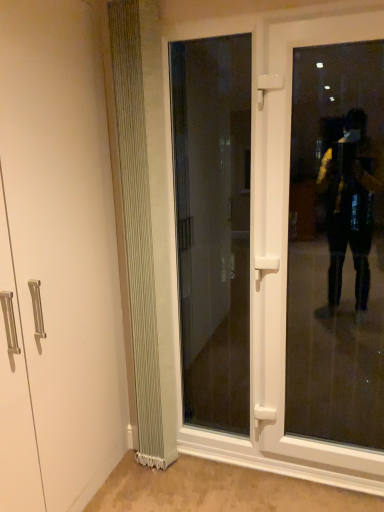
Image resolution: width=384 pixels, height=512 pixels. What are the coordinates of `white plastic door at center, placed as the second door when sorted from left to right` in the screenshot? It's located at (267, 243).

This screenshot has height=512, width=384. What do you see at coordinates (267, 243) in the screenshot?
I see `white plastic door at center, placed as the second door when sorted from left to right` at bounding box center [267, 243].

In order to face transparent glass door at right, should I rotate leftwards or rightwards?

You should rotate right by 17.114 degrees.

This screenshot has width=384, height=512. Describe the element at coordinates (145, 220) in the screenshot. I see `white ribbed radiator at left` at that location.

The height and width of the screenshot is (512, 384). Identify the location of transparent glass door at center, the 2th door positioned from the right. (213, 225).

Is white plastic door at center, positioned as the 1th door in right-to-left order, placed right next to transparent glass door at right?

white plastic door at center, positioned as the 1th door in right-to-left order, and transparent glass door at right are clearly separated.

Considering the sizes of objects white plastic door at center, placed as the second door when sorted from left to right, and transparent glass door at right in the image provided, who is bigger, white plastic door at center, placed as the second door when sorted from left to right, or transparent glass door at right?

Bigger between the two is transparent glass door at right.

Which object is closer to the camera taking this photo, white plastic door at center, placed as the second door when sorted from left to right, or transparent glass door at right?

transparent glass door at right is closer to the camera.

How much distance is there between transparent glass door at center, which appears as the 1th door when viewed from the left, and transparent glass door at right?

transparent glass door at center, which appears as the 1th door when viewed from the left, and transparent glass door at right are 29.16 inches apart from each other.

Looking at their sizes, would you say transparent glass door at center, the 2th door positioned from the right, is wider or thinner than transparent glass door at right?

Clearly, transparent glass door at center, the 2th door positioned from the right, has less width compared to transparent glass door at right.

Considering the relative positions of transparent glass door at center, the 2th door positioned from the right, and transparent glass door at right in the image provided, is transparent glass door at center, the 2th door positioned from the right, in front of transparent glass door at right?

No, it is behind transparent glass door at right.

Which of these two, transparent glass door at center, which appears as the 1th door when viewed from the left, or transparent glass door at right, stands shorter?

transparent glass door at center, which appears as the 1th door when viewed from the left, is shorter.

You are a GUI agent. You are given a task and a screenshot of the screen. Output one action in this format:
    pyautogui.click(x=<x>, y=<y>)
    Task: Click on the radiator above the transparent glass door at right (from the image's perspective)
    The width and height of the screenshot is (384, 512).
    Given the screenshot: What is the action you would take?
    pyautogui.click(x=145, y=220)

Is point (314, 409) in front of point (160, 109)?

No, it is not.

Is transparent glass door at right further to camera compared to white ribbed radiator at left?

No, transparent glass door at right is closer to the camera.

Is transparent glass door at right not close to white ribbed radiator at left?

Absolutely, transparent glass door at right is distant from white ribbed radiator at left.

Is transparent glass door at center, which appears as the 1th door when viewed from the left, facing towards white plastic door at center, placed as the second door when sorted from left to right?

Yes, transparent glass door at center, which appears as the 1th door when viewed from the left, is turned towards white plastic door at center, placed as the second door when sorted from left to right.

Looking at this image, from a real-world perspective, is transparent glass door at center, which appears as the 1th door when viewed from the left, positioned under white plastic door at center, placed as the second door when sorted from left to right, based on gravity?

No, from a real-world perspective, transparent glass door at center, which appears as the 1th door when viewed from the left, is not under white plastic door at center, placed as the second door when sorted from left to right.

Considering the sizes of transparent glass door at center, the 2th door positioned from the right, and white plastic door at center, positioned as the 1th door in right-to-left order, in the image, is transparent glass door at center, the 2th door positioned from the right, taller or shorter than white plastic door at center, positioned as the 1th door in right-to-left order,?

transparent glass door at center, the 2th door positioned from the right, is taller than white plastic door at center, positioned as the 1th door in right-to-left order.

Which is more to the left, transparent glass door at center, which appears as the 1th door when viewed from the left, or white plastic door at center, positioned as the 1th door in right-to-left order?

Positioned to the left is transparent glass door at center, which appears as the 1th door when viewed from the left.

Which is in front, point (340, 123) or point (350, 476)?

The point (340, 123) is in front.

Is transparent glass door at right at the left side of white plastic door at center, placed as the second door when sorted from left to right?

Incorrect, transparent glass door at right is not on the left side of white plastic door at center, placed as the second door when sorted from left to right.

From the image's perspective, is transparent glass door at right located beneath white plastic door at center, placed as the second door when sorted from left to right?

No, from the image's perspective, transparent glass door at right is not below white plastic door at center, placed as the second door when sorted from left to right.

Looking at this image, which point is more distant from viewer, (132,73) or (197,239)?

The point (197,239) is farther from the camera.

Would you say white ribbed radiator at left is a long distance from transparent glass door at center, which appears as the 1th door when viewed from the left?

Yes, white ribbed radiator at left and transparent glass door at center, which appears as the 1th door when viewed from the left, are located far from each other.

Would you say white ribbed radiator at left is outside transparent glass door at center, the 2th door positioned from the right?

Yes, white ribbed radiator at left is not within transparent glass door at center, the 2th door positioned from the right.

Is white ribbed radiator at left bigger than transparent glass door at center, the 2th door positioned from the right?

Indeed, white ribbed radiator at left has a larger size compared to transparent glass door at center, the 2th door positioned from the right.

Which is behind, point (334, 54) or point (237, 89)?

The point (334, 54) is farther.

Where is `door above the transparent glass door at right (from a real-world perspective)`? The height and width of the screenshot is (512, 384). door above the transparent glass door at right (from a real-world perspective) is located at coordinates [213, 225].

Does transparent glass door at right appear on the left side of transparent glass door at center, which appears as the 1th door when viewed from the left?

No, transparent glass door at right is not to the left of transparent glass door at center, which appears as the 1th door when viewed from the left.

Which door is the 1st one when counting from the left side of the transparent glass door at right? Please provide its 2D coordinates.

[(267, 243)]

In order to click on door above the transparent glass door at right (from the image's perspective) in this screenshot , I will do `click(213, 225)`.

Which object lies nearer to the anchor point transparent glass door at right, transparent glass door at center, the 2th door positioned from the right, or white ribbed radiator at left?

transparent glass door at center, the 2th door positioned from the right, lies closer to transparent glass door at right than the other object.

Estimate the real-world distances between objects in this image. Which object is further from white plastic door at center, positioned as the 1th door in right-to-left order, transparent glass door at center, which appears as the 1th door when viewed from the left, or transparent glass door at right?

transparent glass door at right.

From the image, which object appears to be nearer to white plastic door at center, positioned as the 1th door in right-to-left order, transparent glass door at right or transparent glass door at center, which appears as the 1th door when viewed from the left?

transparent glass door at center, which appears as the 1th door when viewed from the left, is closer to white plastic door at center, positioned as the 1th door in right-to-left order.

Estimate the real-world distances between objects in this image. Which object is closer to white ribbed radiator at left, white plastic door at center, positioned as the 1th door in right-to-left order, or transparent glass door at center, the 2th door positioned from the right?

Among the two, white plastic door at center, positioned as the 1th door in right-to-left order, is located nearer to white ribbed radiator at left.

Based on their spatial positions, is transparent glass door at center, which appears as the 1th door when viewed from the left, or transparent glass door at right closer to white ribbed radiator at left?

transparent glass door at center, which appears as the 1th door when viewed from the left.

Looking at the image, which one is located further to white ribbed radiator at left, white plastic door at center, positioned as the 1th door in right-to-left order, or transparent glass door at right?

transparent glass door at right is positioned further to the anchor white ribbed radiator at left.

Looking at the image, which one is located further to transparent glass door at center, which appears as the 1th door when viewed from the left, transparent glass door at right or white plastic door at center, positioned as the 1th door in right-to-left order?

The object further to transparent glass door at center, which appears as the 1th door when viewed from the left, is white plastic door at center, positioned as the 1th door in right-to-left order.

Based on their spatial positions, is white ribbed radiator at left or transparent glass door at right closer to white plastic door at center, placed as the second door when sorted from left to right?

Based on the image, white ribbed radiator at left appears to be nearer to white plastic door at center, placed as the second door when sorted from left to right.

This screenshot has height=512, width=384. I want to click on door situated between white ribbed radiator at left and white plastic door at center, positioned as the 1th door in right-to-left order, from left to right, so 213,225.

At what (x,y) coordinates should I click in order to perform the action: click on door between transparent glass door at center, the 2th door positioned from the right, and transparent glass door at right from left to right. Please return your answer as a coordinate pair (x, y). The height and width of the screenshot is (512, 384). Looking at the image, I should click on (267, 243).